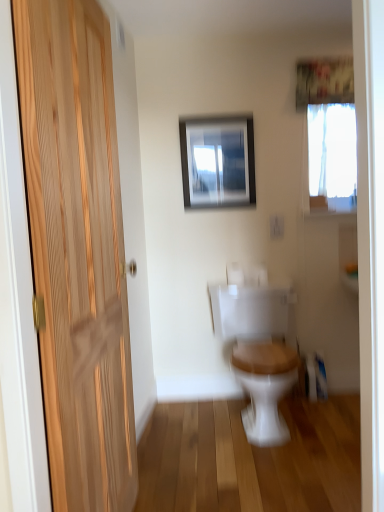
Measure the distance between point (241, 132) and camera.

Point (241, 132) is 8.71 feet from camera.

Describe the element at coordinates (259, 353) in the screenshot. I see `white wood toilet at center` at that location.

Locate an element on the screen. white sheer curtain at upper center is located at coordinates (324, 81).

This screenshot has width=384, height=512. What are the coordinates of `metallic silver picture frame at upper center` in the screenshot? It's located at click(217, 161).

Is white sheer curtain at upper center bigger than wooden door at left?

No.

Considering the positions of objects white sheer curtain at upper center and wooden door at left in the image provided, who is more to the right, white sheer curtain at upper center or wooden door at left?

white sheer curtain at upper center is more to the right.

Is white sheer curtain at upper center positioned with its back to wooden door at left?

No, white sheer curtain at upper center is not facing the opposite direction of wooden door at left.

Are white sheer curtain at upper center and wooden door at left beside each other?

No, white sheer curtain at upper center is not making contact with wooden door at left.

From a real-world perspective, who is located higher, wooden door at left or white sheer curtain at upper center?

white sheer curtain at upper center.

How different are the orientations of wooden door at left and white sheer curtain at upper center in degrees?

There is a 85.6-degree angle between the facing directions of wooden door at left and white sheer curtain at upper center.

From the picture: Is wooden door at left oriented towards white sheer curtain at upper center?

No, wooden door at left is not aimed at white sheer curtain at upper center.

From a real-world perspective, is wooden door at left above or below white wood toilet at center?

In terms of real-world spatial position, wooden door at left is above white wood toilet at center.

Which point is more forward, (112, 207) or (232, 336)?

Positioned in front is point (112, 207).

From the image's perspective, is wooden door at left under white wood toilet at center?

No, from the image's perspective, wooden door at left is not beneath white wood toilet at center.

How different are the orientations of wooden door at left and white wood toilet at center in degrees?

There is a 86-degree angle between the facing directions of wooden door at left and white wood toilet at center.

Considering the relative sizes of white wood toilet at center and white sheer curtain at upper center in the image provided, is white wood toilet at center shorter than white sheer curtain at upper center?

Incorrect, the height of white wood toilet at center does not fall short of that of white sheer curtain at upper center.

From a real-world perspective, is white wood toilet at center positioned above or below white sheer curtain at upper center?

In terms of real-world spatial position, white wood toilet at center is below white sheer curtain at upper center.

Is white wood toilet at center facing away from white sheer curtain at upper center?

No, white wood toilet at center's orientation is not away from white sheer curtain at upper center.

From the image's perspective, is white wood toilet at center located above or below white sheer curtain at upper center?

Based on their image positions, white wood toilet at center is located beneath white sheer curtain at upper center.

Can you confirm if wooden door at left is wider than metallic silver picture frame at upper center?

Indeed, wooden door at left has a greater width compared to metallic silver picture frame at upper center.

Is wooden door at left bigger or smaller than metallic silver picture frame at upper center?

Clearly, wooden door at left is larger in size than metallic silver picture frame at upper center.

Is wooden door at left looking in the opposite direction of metallic silver picture frame at upper center?

No.

Who is shorter, metallic silver picture frame at upper center or wooden door at left?

metallic silver picture frame at upper center.

From the picture: Does metallic silver picture frame at upper center lie in front of wooden door at left?

No, metallic silver picture frame at upper center is behind wooden door at left.

Can you confirm if metallic silver picture frame at upper center is wider than wooden door at left?

Incorrect, the width of metallic silver picture frame at upper center does not surpass that of wooden door at left.

Which of these two, metallic silver picture frame at upper center or wooden door at left, is smaller?

metallic silver picture frame at upper center is smaller.

Who is taller, white sheer curtain at upper center or white wood toilet at center?

Standing taller between the two is white wood toilet at center.

Would you consider white sheer curtain at upper center to be distant from white wood toilet at center?

white sheer curtain at upper center is positioned a significant distance from white wood toilet at center.

In the scene shown: Considering the sizes of objects white sheer curtain at upper center and white wood toilet at center in the image provided, who is smaller, white sheer curtain at upper center or white wood toilet at center?

white sheer curtain at upper center is smaller.

Is white wood toilet at center surrounded by white sheer curtain at upper center?

Definitely not — white wood toilet at center is not inside white sheer curtain at upper center.

Identify the location of door on the left of white sheer curtain at upper center. (77, 250).

Locate an element on the screen. This screenshot has height=512, width=384. curtain above the wooden door at left (from a real-world perspective) is located at coordinates pos(324,81).

Looking at the image, which one is located further to metallic silver picture frame at upper center, white sheer curtain at upper center or white wood toilet at center?

Based on the image, white wood toilet at center appears to be further to metallic silver picture frame at upper center.

Considering their positions, is white wood toilet at center positioned further to metallic silver picture frame at upper center than white sheer curtain at upper center?

The object further to metallic silver picture frame at upper center is white wood toilet at center.

Based on the photo, estimate the real-world distances between objects in this image. Which object is closer to wooden door at left, white sheer curtain at upper center or metallic silver picture frame at upper center?

metallic silver picture frame at upper center.

Looking at the image, which one is located closer to white sheer curtain at upper center, white wood toilet at center or metallic silver picture frame at upper center?

Among the two, metallic silver picture frame at upper center is located nearer to white sheer curtain at upper center.

Considering their positions, is white sheer curtain at upper center positioned closer to metallic silver picture frame at upper center than wooden door at left?

The object closer to metallic silver picture frame at upper center is white sheer curtain at upper center.

From the image, which object appears to be farther from wooden door at left, metallic silver picture frame at upper center or white wood toilet at center?

metallic silver picture frame at upper center.

Considering their positions, is white wood toilet at center positioned closer to white sheer curtain at upper center than wooden door at left?

The object closer to white sheer curtain at upper center is white wood toilet at center.

Which object lies further to the anchor point white sheer curtain at upper center, wooden door at left or metallic silver picture frame at upper center?

Among the two, wooden door at left is located further to white sheer curtain at upper center.

Identify the location of toilet between wooden door at left and metallic silver picture frame at upper center along the z-axis. (259, 353).

The image size is (384, 512). Find the location of `curtain located between wooden door at left and metallic silver picture frame at upper center in the depth direction`. curtain located between wooden door at left and metallic silver picture frame at upper center in the depth direction is located at coordinates (324, 81).

The width and height of the screenshot is (384, 512). I want to click on toilet located between wooden door at left and white sheer curtain at upper center in the depth direction, so click(259, 353).

Identify the location of picture frame between white sheer curtain at upper center and white wood toilet at center vertically. This screenshot has height=512, width=384. (217, 161).